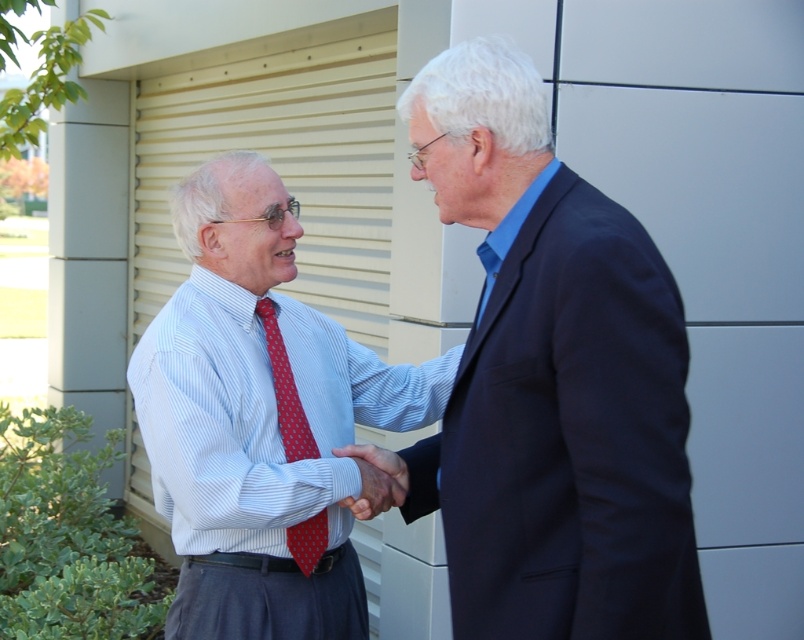
You are a photographer standing 10 feet away from the two men in the image. You want to capture a closeup shot of both the blue fabric suit at center and the striped cotton shirt at center in the same frame. Can you do this without zooming in?

The blue fabric suit at center and striped cotton shirt at center are 25.09 inches apart. Since the photographer is 10 feet away, the distance between the two objects is within the field of view of a standard camera lens without zooming, so yes, they can be captured in the same frame.

You are standing at the point marked as point (269,524) in the image. The building facade is 10 feet away from you. Can you see the two people shaking hands in front of the building?

The distance of point (269,524) from viewer is 7.50 feet, which is closer than the building facade at 10 feet. Therefore, you are positioned in front of the building and can see the two people shaking hands in front of the building.

You are a photographer trying to capture a clear photo of both the blue fabric suit at center and the matte red tie at center. Since you can only focus on one object at a time, which one should you focus on to ensure the other is also in focus?

The blue fabric suit at center is closer to the viewer than the matte red tie at center. By focusing on the blue fabric suit at center, the matte red tie at center will also be in focus because it is further away but within the depth of field.